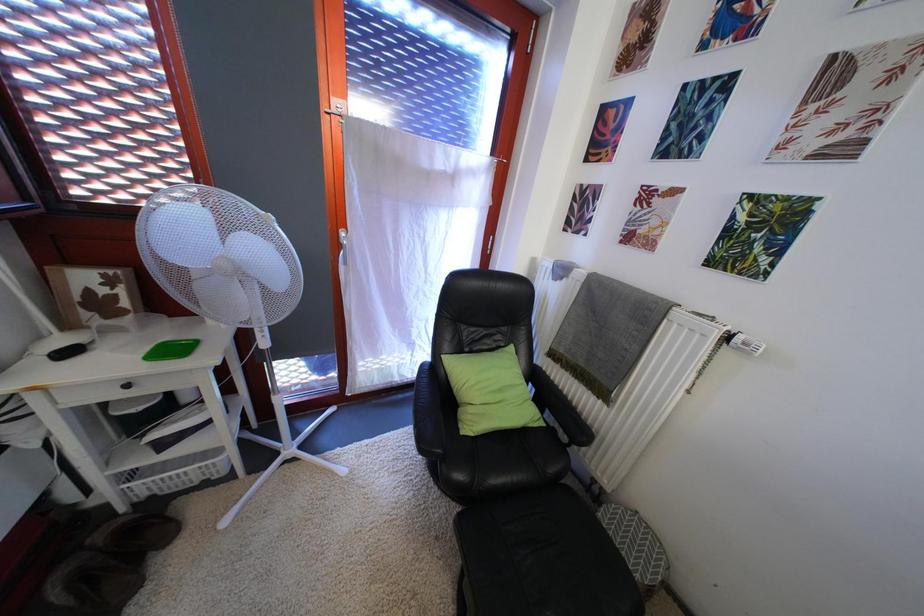
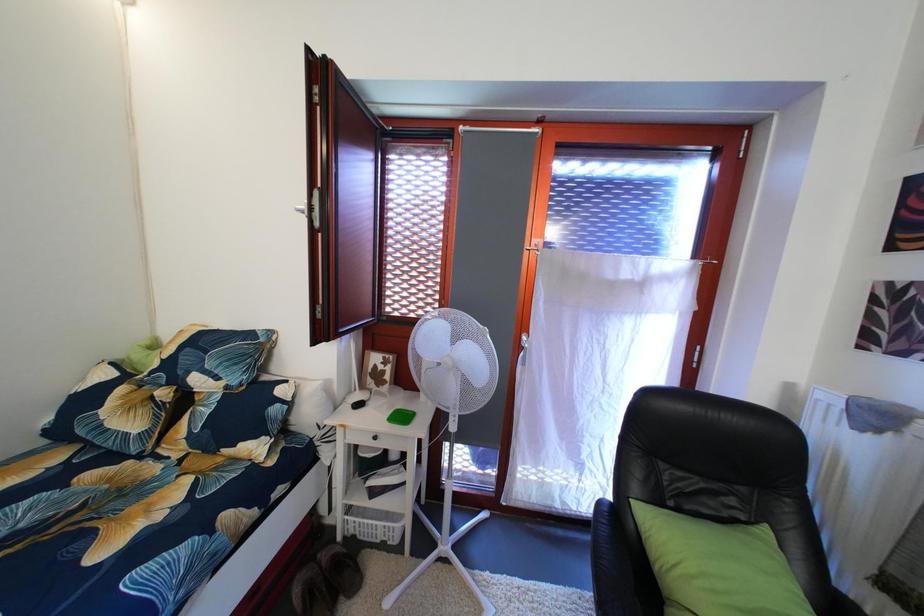
How did the camera likely rotate?

The rotation direction of the camera is left-up.